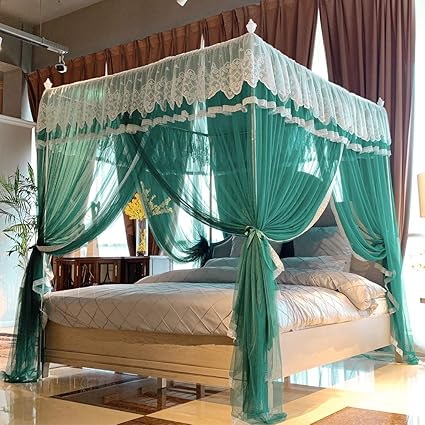
The image size is (425, 425). What are the coordinates of `brown curtain` in the screenshot? It's located at 367,60.